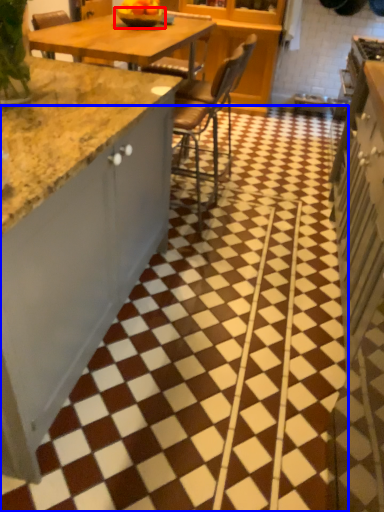
Question: Which of the following is the closest to the observer, bowl (highlighted by a red box) or tile (highlighted by a blue box)?

Choices:
 (A) bowl
 (B) tile

Answer: (B)